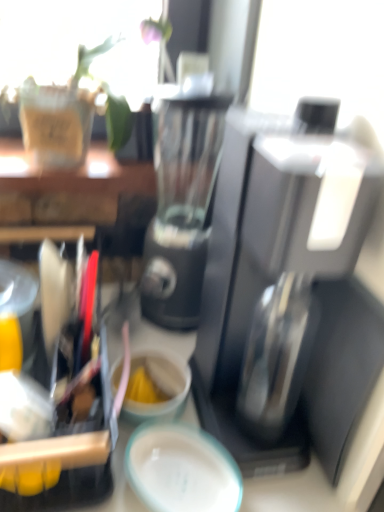
What do you see at coordinates (182, 470) in the screenshot? The image size is (384, 512). I see `teal glossy plate at center` at bounding box center [182, 470].

The width and height of the screenshot is (384, 512). Describe the element at coordinates (159, 385) in the screenshot. I see `matte ceramic coffee cup at center` at that location.

At what (x,y) coordinates should I click in order to perform the action: click on teal glossy plate at center. Please return your answer as a coordinate pair (x, y). The height and width of the screenshot is (512, 384). Looking at the image, I should click on pyautogui.click(x=182, y=470).

From the image's perspective, does matte ceramic coffee cup at center appear lower than teal glossy plate at center?

No, from the image's perspective, matte ceramic coffee cup at center is not below teal glossy plate at center.

In the scene shown: Can you confirm if matte ceramic coffee cup at center is positioned to the left of teal glossy plate at center?

Indeed, matte ceramic coffee cup at center is positioned on the left side of teal glossy plate at center.

From a real-world perspective, relative to teal glossy plate at center, is matte ceramic coffee cup at center vertically above or below?

matte ceramic coffee cup at center is situated higher than teal glossy plate at center in the real world.

How many degrees apart are the facing directions of matte ceramic coffee cup at center and teal glossy plate at center?

58.2 degrees.

From their relative heights in the image, would you say sleek black coffee maker at center is taller or shorter than matte ceramic coffee cup at center?

Considering their sizes, sleek black coffee maker at center has more height than matte ceramic coffee cup at center.

From a real-world perspective, which is physically below, sleek black coffee maker at center or matte ceramic coffee cup at center?

In real-world perspective, matte ceramic coffee cup at center is lower.

Would you say sleek black coffee maker at center is to the left or to the right of matte ceramic coffee cup at center in the picture?

Based on their positions, sleek black coffee maker at center is located to the right of matte ceramic coffee cup at center.

From a real-world perspective, is teal glossy plate at center positioned under matte ceramic coffee cup at center based on gravity?

Yes, from a real-world perspective, teal glossy plate at center is beneath matte ceramic coffee cup at center.

Can you confirm if teal glossy plate at center is bigger than matte ceramic coffee cup at center?

Incorrect, teal glossy plate at center is not larger than matte ceramic coffee cup at center.

Identify the location of coffee cup above the teal glossy plate at center (from a real-world perspective). The width and height of the screenshot is (384, 512). (159, 385).

Choose the correct answer: Is teal glossy plate at center inside sleek black coffee maker at center or outside it?

teal glossy plate at center is spatially situated outside sleek black coffee maker at center.

Which of these two, teal glossy plate at center or sleek black coffee maker at center, is smaller?

Smaller between the two is teal glossy plate at center.

How different are the orientations of teal glossy plate at center and sleek black coffee maker at center in degrees?

teal glossy plate at center and sleek black coffee maker at center are facing 51.8 degrees away from each other.

Is teal glossy plate at center taller or shorter than sleek black coffee maker at center?

teal glossy plate at center is shorter than sleek black coffee maker at center.

Based on their sizes in the image, would you say matte ceramic coffee cup at center is bigger or smaller than sleek black coffee maker at center?

In the image, matte ceramic coffee cup at center appears to be smaller than sleek black coffee maker at center.

From a real-world perspective, does matte ceramic coffee cup at center sit lower than sleek black coffee maker at center?

Yes, from a real-world perspective, matte ceramic coffee cup at center is under sleek black coffee maker at center.

Consider the image. Can you confirm if matte ceramic coffee cup at center is positioned to the right of sleek black coffee maker at center?

Incorrect, matte ceramic coffee cup at center is not on the right side of sleek black coffee maker at center.

Considering the relative positions of sleek black coffee maker at center and teal glossy plate at center in the image provided, is sleek black coffee maker at center to the right of teal glossy plate at center from the viewer's perspective?

Correct, you'll find sleek black coffee maker at center to the right of teal glossy plate at center.

Is sleek black coffee maker at center placed right next to teal glossy plate at center?

No.

In the image, there is a sleek black coffee maker at center. In order to click on plate below it (from a real-world perspective) in this screenshot , I will do `click(182, 470)`.

Is sleek black coffee maker at center oriented towards teal glossy plate at center?

No.

Identify the location of coffee cup behind the teal glossy plate at center. This screenshot has width=384, height=512. [x=159, y=385].

What are the coordinates of `coffee maker located in front of the matte ceramic coffee cup at center` in the screenshot? It's located at (291, 286).

Based on their spatial positions, is sleek black coffee maker at center or teal glossy plate at center closer to matte ceramic coffee cup at center?

teal glossy plate at center is closer to matte ceramic coffee cup at center.

From the image, which object appears to be farther from sleek black coffee maker at center, teal glossy plate at center or matte ceramic coffee cup at center?

matte ceramic coffee cup at center.

Based on their spatial positions, is matte ceramic coffee cup at center or teal glossy plate at center closer to sleek black coffee maker at center?

teal glossy plate at center is closer to sleek black coffee maker at center.

Based on their spatial positions, is matte ceramic coffee cup at center or sleek black coffee maker at center further from teal glossy plate at center?

sleek black coffee maker at center.

When comparing their distances from teal glossy plate at center, does sleek black coffee maker at center or matte ceramic coffee cup at center seem closer?

The object closer to teal glossy plate at center is matte ceramic coffee cup at center.

Estimate the real-world distances between objects in this image. Which object is closer to matte ceramic coffee cup at center, teal glossy plate at center or sleek black coffee maker at center?

The object closer to matte ceramic coffee cup at center is teal glossy plate at center.

You are a GUI agent. You are given a task and a screenshot of the screen. Output one action in this format:
    pyautogui.click(x=<x>, y=<y>)
    Task: Click on the plate located between sleek black coffee maker at center and matte ceramic coffee cup at center in the depth direction
    This screenshot has width=384, height=512.
    Given the screenshot: What is the action you would take?
    tap(182, 470)